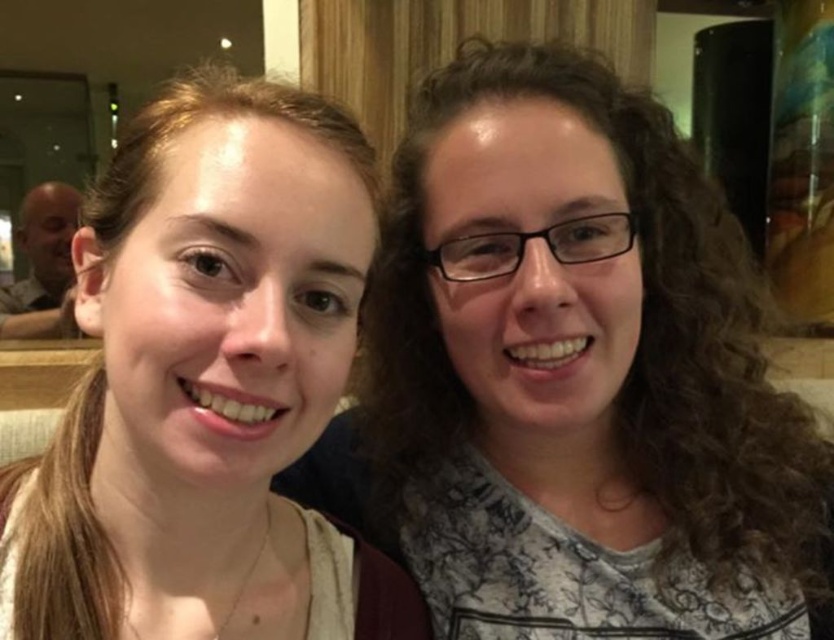
Question: Which of the following is the closest to the observer?

Choices:
 (A) matte black hair at upper right
 (B) matte brown hair at left

Answer: (B)

Question: Is matte black hair at upper right above matte brown hair at left?

Choices:
 (A) yes
 (B) no

Answer: (A)

Question: Which point is farther to the camera?

Choices:
 (A) matte black hair at upper right
 (B) matte brown hair at left

Answer: (A)

Question: Is matte black hair at upper right smaller than matte brown hair at left?

Choices:
 (A) no
 (B) yes

Answer: (A)

Question: Is matte black hair at upper right closer to camera compared to matte brown hair at left?

Choices:
 (A) yes
 (B) no

Answer: (B)

Question: Which object appears farthest from the camera in this image?

Choices:
 (A) matte brown hair at left
 (B) matte black hair at upper right

Answer: (B)